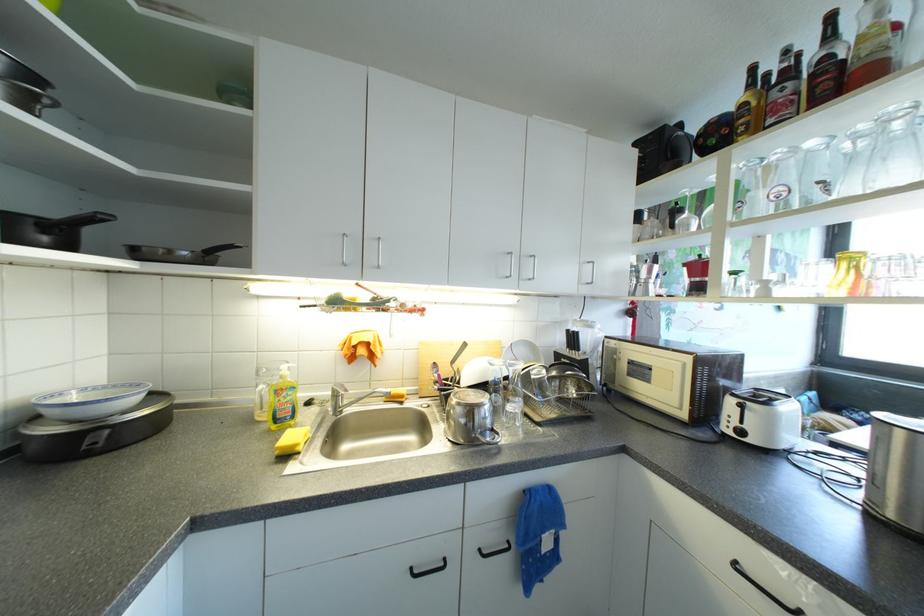
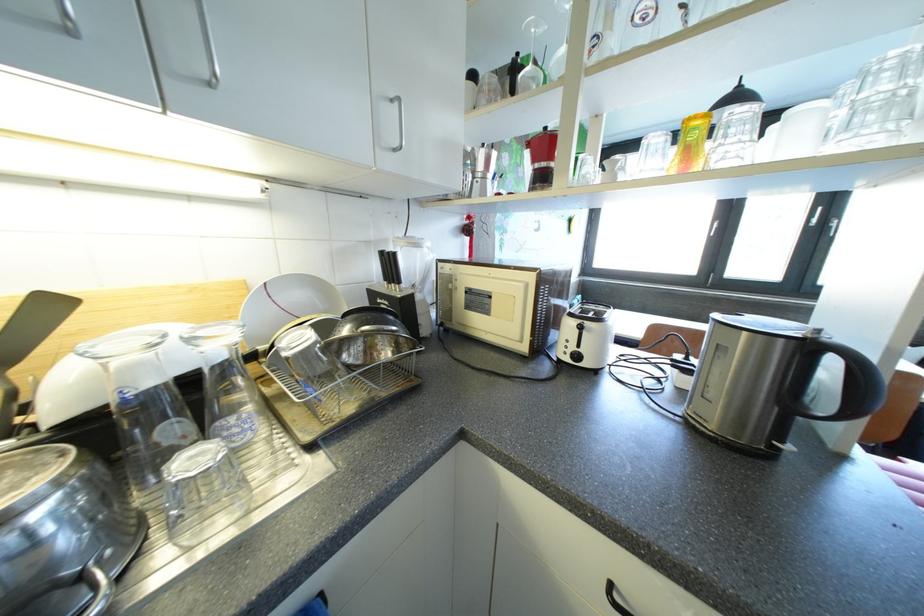
Locate, in the second image, the point that corresponds to [736,436] in the first image.

(573, 362)